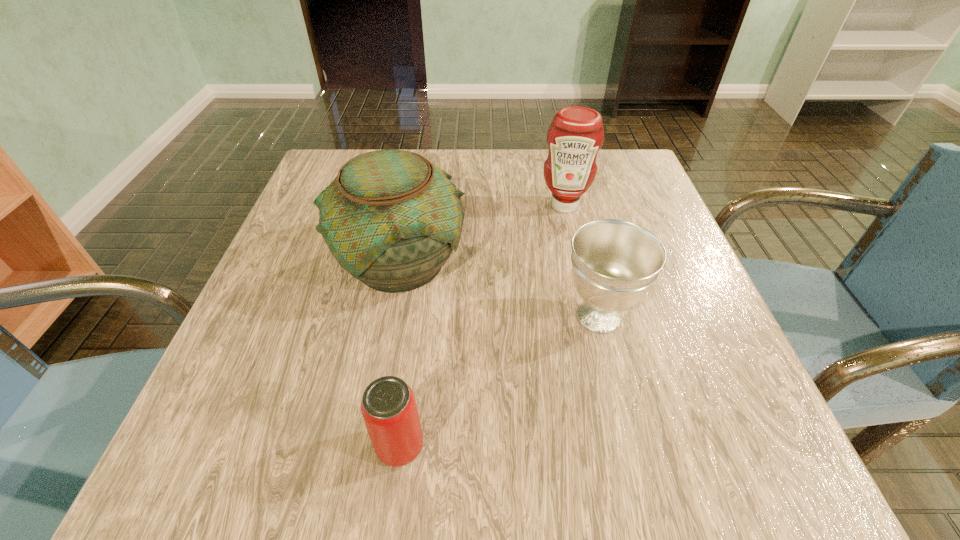
You are a GUI agent. You are given a task and a screenshot of the screen. Output one action in this format:
    pyautogui.click(x=<x>, y=<y>)
    Task: Click on the farthest object
    The image size is (960, 540).
    Given the screenshot: What is the action you would take?
    pyautogui.click(x=576, y=134)

This screenshot has width=960, height=540. Identify the location of pottery. (391, 219).

Image resolution: width=960 pixels, height=540 pixels. Find the location of `the third tallest object`. the third tallest object is located at coordinates (614, 262).

Find the location of `beer can`. beer can is located at coordinates (388, 406).

Identify the location of the shortest object. (388, 406).

At what (x,y) coordinates should I click in order to perform the action: click on vacant space located 0.100m on the right of the farthest object. Please return your answer as a coordinate pair (x, y). The image size is (960, 540). Looking at the image, I should click on (634, 205).

The height and width of the screenshot is (540, 960). I want to click on vacant space located on the right of the pottery, so 612,260.

Locate an element on the screen. The width and height of the screenshot is (960, 540). vacant area situated 0.380m on the back of the chalice is located at coordinates (564, 174).

You are a GUI agent. You are given a task and a screenshot of the screen. Output one action in this format:
    pyautogui.click(x=<x>, y=<y>)
    Task: Click on the blank space located 0.320m on the right of the nearest object
    The height and width of the screenshot is (540, 960).
    Given the screenshot: What is the action you would take?
    pyautogui.click(x=661, y=446)

This screenshot has width=960, height=540. I want to click on object that is at the far edge, so click(x=576, y=134).